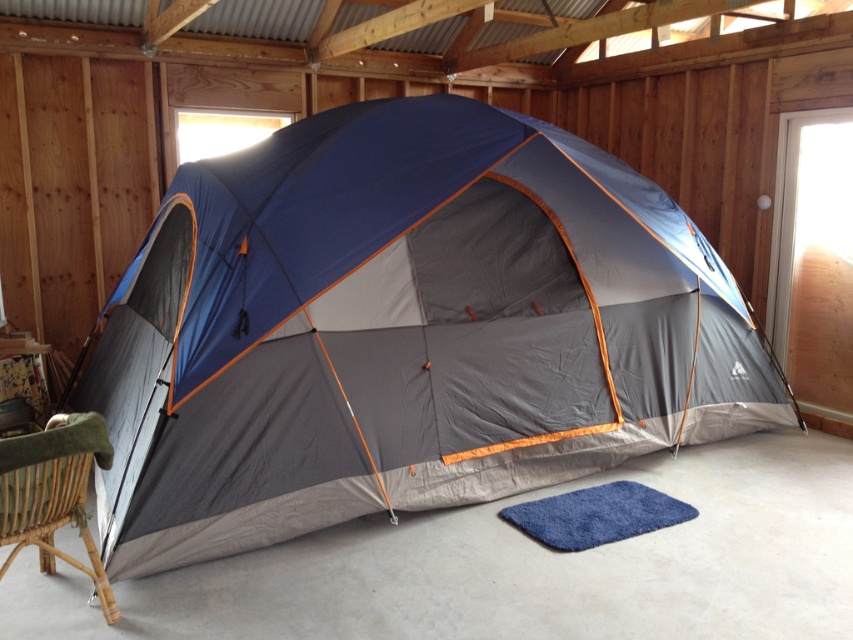
Question: Observing the image, what is the correct spatial positioning of blue fabric tent at center in reference to green woven chair at lower left?

Choices:
 (A) below
 (B) above

Answer: (B)

Question: Which point appears closest to the camera in this image?

Choices:
 (A) (778, 422)
 (B) (10, 436)

Answer: (B)

Question: Can you confirm if blue fabric tent at center is smaller than green woven chair at lower left?

Choices:
 (A) yes
 (B) no

Answer: (B)

Question: Is blue fabric tent at center positioned in front of green woven chair at lower left?

Choices:
 (A) no
 (B) yes

Answer: (A)